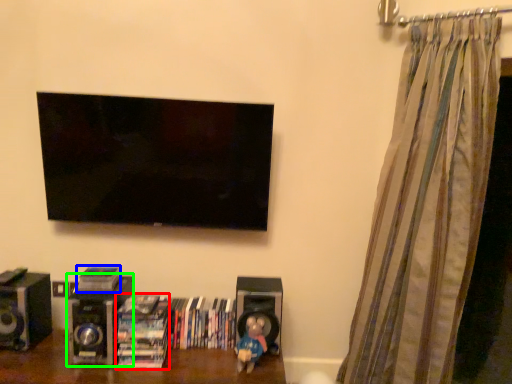
Question: Which object is positioned farthest from book (highlighted by a red box)? Select from book (highlighted by a blue box) and speaker (highlighted by a green box).

Choices:
 (A) book
 (B) speaker

Answer: (A)